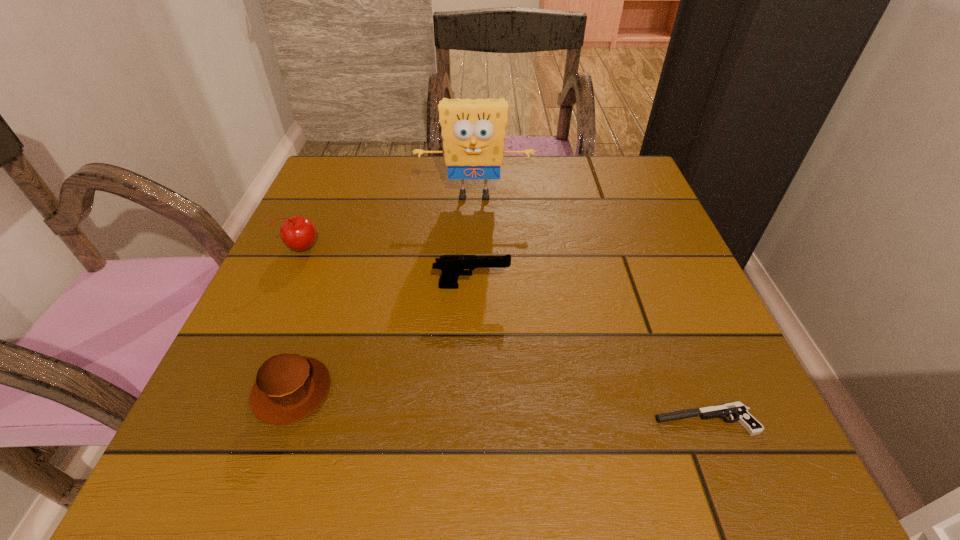
Where is `vacant space located 0.230m on the front-facing side of the farther pistol`? This screenshot has width=960, height=540. vacant space located 0.230m on the front-facing side of the farther pistol is located at coordinates (630, 286).

Find the location of `blank area located on the left of the muffin`. blank area located on the left of the muffin is located at coordinates [x=207, y=391].

Where is `free region located 0.250m on the front-facing side of the nearer pistol`? This screenshot has height=540, width=960. free region located 0.250m on the front-facing side of the nearer pistol is located at coordinates (484, 420).

Where is `vacant point located on the front-facing side of the nearer pistol`? vacant point located on the front-facing side of the nearer pistol is located at coordinates pyautogui.click(x=504, y=420).

You are a GUI agent. You are given a task and a screenshot of the screen. Output one action in this format:
    pyautogui.click(x=<x>, y=<y>)
    Task: Click on the vacant space located on the front-facing side of the nearer pistol
    This screenshot has height=540, width=960.
    Given the screenshot: What is the action you would take?
    pyautogui.click(x=608, y=420)

Find the location of a particular element. Image resolution: width=960 pixels, height=540 pixels. object that is at the far edge is located at coordinates (473, 131).

What are the coordinates of `muffin present at the near edge` in the screenshot? It's located at (289, 387).

The image size is (960, 540). What are the coordinates of `pistol located at the near edge` in the screenshot? It's located at (737, 409).

Find the location of a particular element. This screenshot has height=540, width=960. cherry that is positioned at the left edge is located at coordinates (299, 233).

Find the location of a particular element. Image resolution: width=960 pixels, height=540 pixels. muffin present at the left edge is located at coordinates (289, 387).